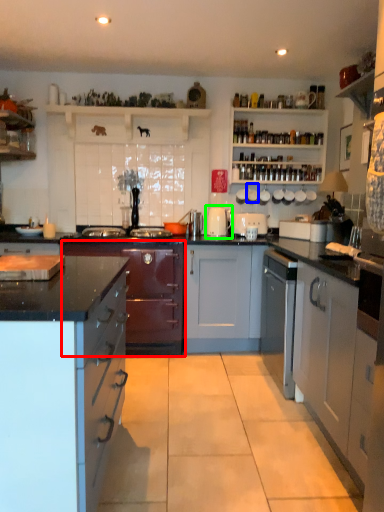
Question: Based on their relative distances, which object is nearer to cabinetry (highlighted by a red box)? Choose from appliance (highlighted by a blue box) and appliance (highlighted by a green box).

Choices:
 (A) appliance
 (B) appliance

Answer: (B)